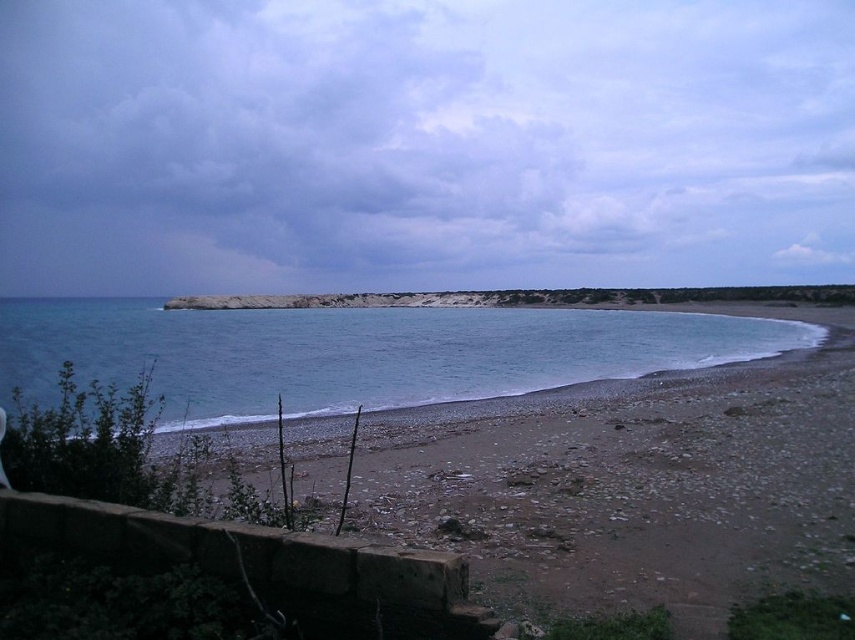
Which is in front, point (652, 566) or point (382, 400)?

Positioned in front is point (652, 566).

Is smooth sand beach at lower right bigger than blue water at lower left?

No, smooth sand beach at lower right is not bigger than blue water at lower left.

This screenshot has height=640, width=855. Describe the element at coordinates (634, 483) in the screenshot. I see `smooth sand beach at lower right` at that location.

You are a GUI agent. You are given a task and a screenshot of the screen. Output one action in this format:
    pyautogui.click(x=<x>, y=<y>)
    Task: Click on the smooth sand beach at lower right
    The height and width of the screenshot is (640, 855).
    Given the screenshot: What is the action you would take?
    pyautogui.click(x=634, y=483)